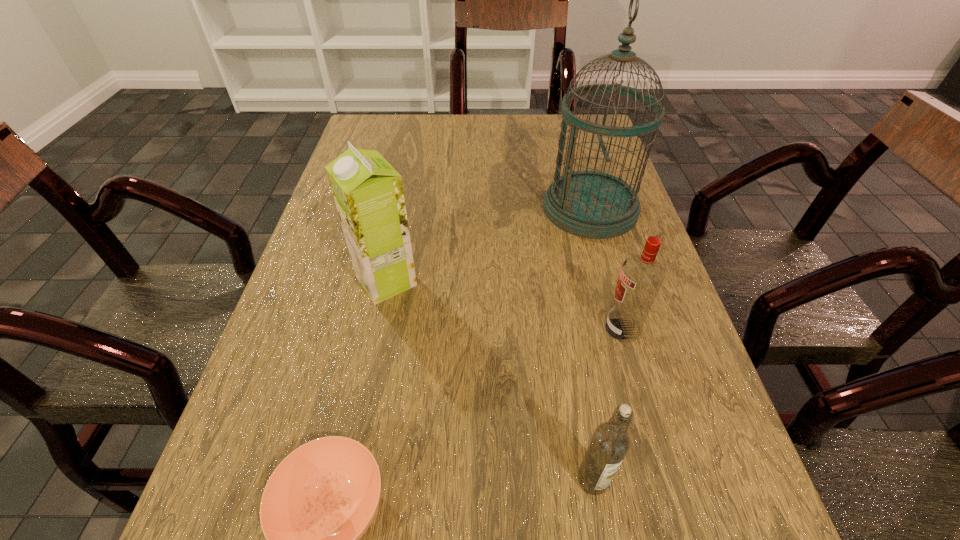
Locate an element on the screen. This screenshot has width=960, height=540. vacant space at the far left corner is located at coordinates (353, 140).

Locate an element on the screen. vacant space at the far right corner is located at coordinates (587, 132).

Find the location of a particular element. vacant area that lies between the left vodka and the third farthest object is located at coordinates (608, 404).

Identify the location of vacant region between the fourth shortest object and the birdcage. This screenshot has width=960, height=540. (489, 245).

Image resolution: width=960 pixels, height=540 pixels. I want to click on free space between the second tallest object and the farther vodka, so click(504, 305).

Find the location of `free space between the right vodka and the tallest object`. free space between the right vodka and the tallest object is located at coordinates (607, 268).

This screenshot has width=960, height=540. What are the coordinates of `empty space between the tallest object and the right vodka` in the screenshot? It's located at (607, 268).

You are a GUI agent. You are given a task and a screenshot of the screen. Output one action in this format:
    pyautogui.click(x=<x>, y=<y>)
    Task: Click on the free space that is in between the second farthest object and the birdcage
    This screenshot has width=960, height=540.
    Given the screenshot: What is the action you would take?
    pyautogui.click(x=489, y=245)

Identify the location of the fourth closest object relative to the soup bowl. This screenshot has height=540, width=960. (591, 204).

Choose which object is the third nearest neighbor to the left vodka. Please provide its 2D coordinates. Your answer should be formatted as a tuple, i.e. [(x, y)], where the tuple contains the x and y coordinates of a point satisfying the conditions above.

[(368, 192)]